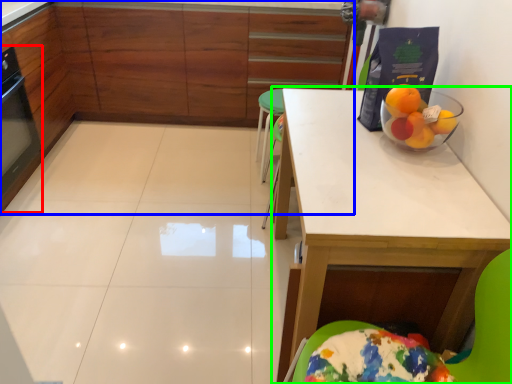
Question: Which object is the closest to the appliance (highlighted by a red box)? Choose among these: cabinetry (highlighted by a blue box) or table (highlighted by a green box).

Choices:
 (A) cabinetry
 (B) table

Answer: (A)